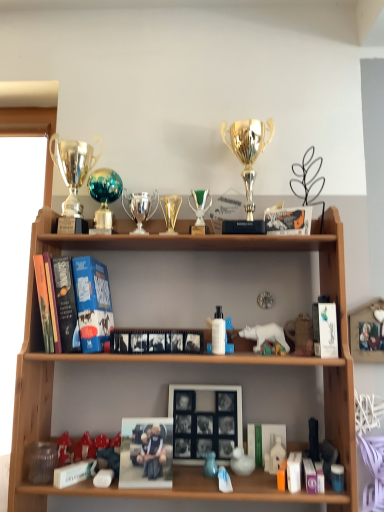
Question: Is shiny silver trophy at upper left, positioned as the first trophy in left-to-right order, wider than white glossy book at upper right, placed as the 4th book when sorted from bottom to top?

Choices:
 (A) no
 (B) yes

Answer: (B)

Question: Does shiny silver trophy at upper left, the 3th trophy viewed from the right, have a lesser width compared to white glossy book at upper right, which is the 5th book in left-to-right order?

Choices:
 (A) no
 (B) yes

Answer: (A)

Question: Does shiny silver trophy at upper left, positioned as the first trophy in left-to-right order, have a greater height compared to white glossy book at upper right, which is the 5th book in left-to-right order?

Choices:
 (A) no
 (B) yes

Answer: (B)

Question: Is shiny silver trophy at upper left, the 3th trophy viewed from the right, not within white glossy book at upper right, the 2th book when ordered from top to bottom?

Choices:
 (A) no
 (B) yes

Answer: (B)

Question: From a real-world perspective, is shiny silver trophy at upper left, positioned as the first trophy in left-to-right order, under white glossy book at upper right, the 2th book when ordered from top to bottom?

Choices:
 (A) yes
 (B) no

Answer: (B)

Question: Is white glossy book at upper right, placed as the 4th book when sorted from bottom to top, surrounded by shiny silver trophy at upper left, the 3th trophy viewed from the right?

Choices:
 (A) yes
 (B) no

Answer: (B)

Question: Is white plastic bear at center, which ranks as the 4th toy in right-to-left order, taller than orange matte toy at lower center, positioned as the 3th toy in right-to-left order?

Choices:
 (A) yes
 (B) no

Answer: (A)

Question: Does white plastic bear at center, which ranks as the 4th toy in right-to-left order, have a lesser height compared to orange matte toy at lower center, positioned as the 3th toy in right-to-left order?

Choices:
 (A) yes
 (B) no

Answer: (B)

Question: Can you confirm if white plastic bear at center, arranged as the 6th toy when viewed from the left, is wider than orange matte toy at lower center, arranged as the seventh toy when viewed from the left?

Choices:
 (A) yes
 (B) no

Answer: (A)

Question: Considering the relative sizes of white plastic bear at center, arranged as the 6th toy when viewed from the left, and orange matte toy at lower center, positioned as the 3th toy in right-to-left order, in the image provided, is white plastic bear at center, arranged as the 6th toy when viewed from the left, smaller than orange matte toy at lower center, positioned as the 3th toy in right-to-left order,?

Choices:
 (A) yes
 (B) no

Answer: (B)

Question: Is white plastic bear at center, which ranks as the 4th toy in right-to-left order, not near orange matte toy at lower center, positioned as the 3th toy in right-to-left order?

Choices:
 (A) no
 (B) yes

Answer: (A)

Question: Is white plastic bear at center, which ranks as the 4th toy in right-to-left order, not inside orange matte toy at lower center, positioned as the 3th toy in right-to-left order?

Choices:
 (A) no
 (B) yes

Answer: (B)

Question: From a real-world perspective, is white plastic bear at center, arranged as the 6th toy when viewed from the left, positioned over green glass trophy at center, placed as the first candle holder when sorted from right to left, based on gravity?

Choices:
 (A) no
 (B) yes

Answer: (A)